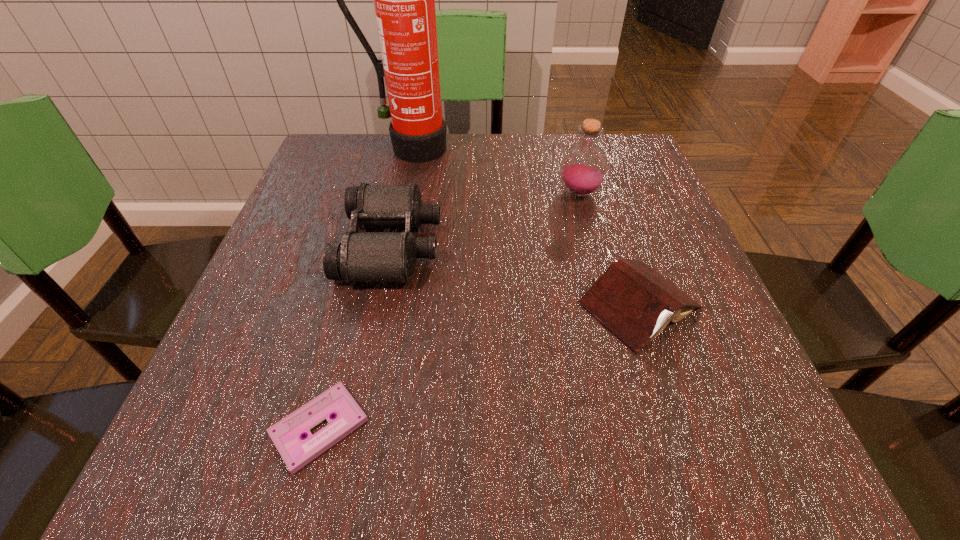
Locate an element on the screen. This screenshot has height=540, width=960. vacant region that satisfies the following two spatial constraints: 1. on the front side of the fourth shortest object; 2. through the eyepieces of the binoculars is located at coordinates (592, 245).